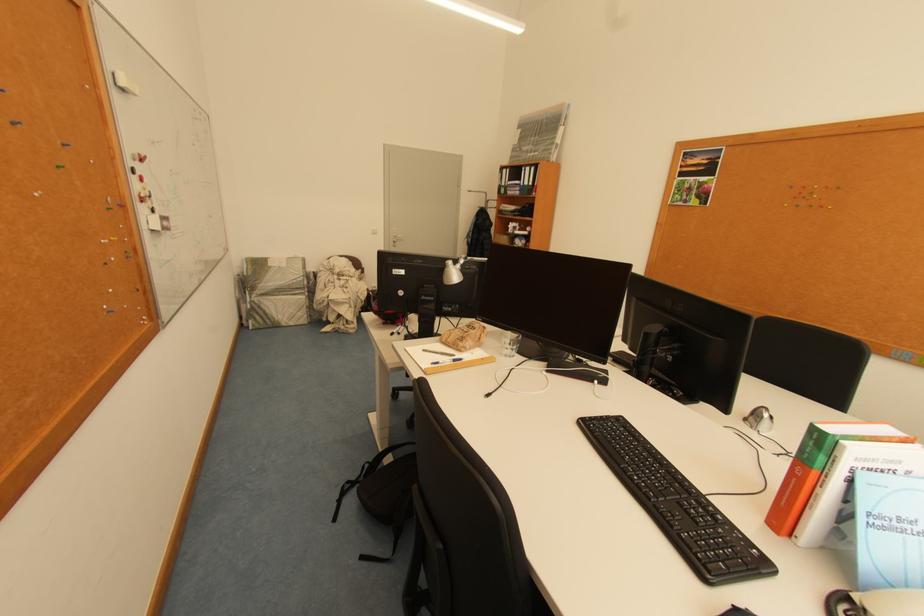
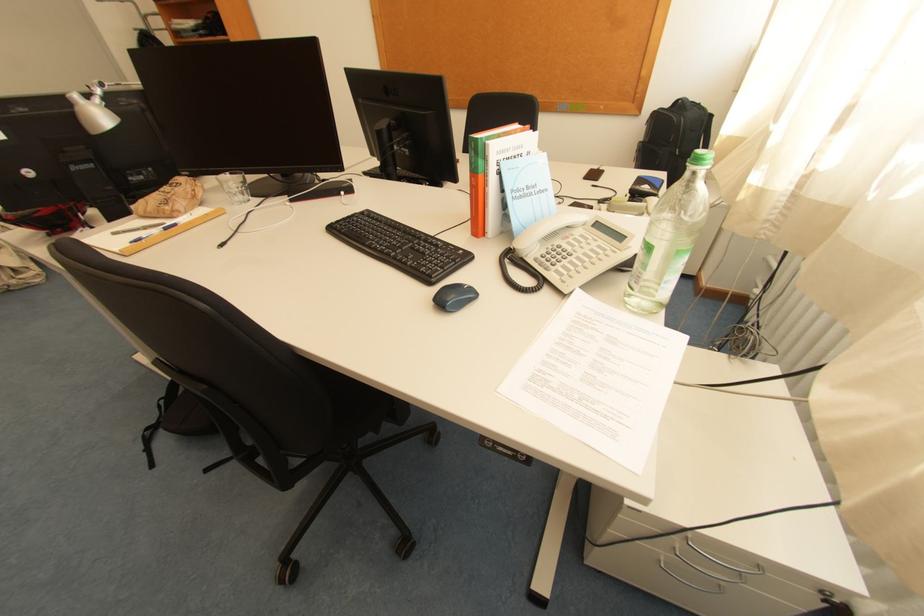
Locate, in the second image, the point that corresponds to (x=517, y=353) in the first image.

(248, 198)